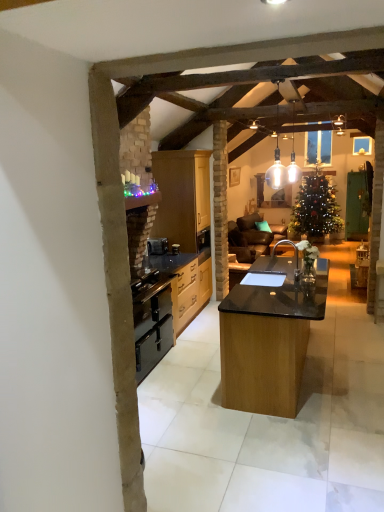
Question: Does translucent glass pendant lights at upper center touch black matte sink at center?

Choices:
 (A) no
 (B) yes

Answer: (A)

Question: From a real-world perspective, is translucent glass pendant lights at upper center located higher than black matte sink at center?

Choices:
 (A) yes
 (B) no

Answer: (A)

Question: Is translucent glass pendant lights at upper center facing away from black matte sink at center?

Choices:
 (A) yes
 (B) no

Answer: (B)

Question: Is translucent glass pendant lights at upper center smaller than black matte sink at center?

Choices:
 (A) no
 (B) yes

Answer: (B)

Question: Could you tell me if translucent glass pendant lights at upper center is facing black matte sink at center?

Choices:
 (A) yes
 (B) no

Answer: (B)

Question: Is translucent glass pendant lights at upper center completely or partially outside of black matte sink at center?

Choices:
 (A) yes
 (B) no

Answer: (A)

Question: Does black wood cabinets at center, arranged as the first cabinetry when ordered from the bottom, come in front of translucent glass pendant lights at upper center?

Choices:
 (A) yes
 (B) no

Answer: (B)

Question: Would you consider black wood cabinets at center, the 2th cabinetry in the top-to-bottom sequence, to be distant from translucent glass pendant lights at upper center?

Choices:
 (A) no
 (B) yes

Answer: (B)

Question: Considering the relative sizes of black wood cabinets at center, the 2th cabinetry in the top-to-bottom sequence, and translucent glass pendant lights at upper center in the image provided, is black wood cabinets at center, the 2th cabinetry in the top-to-bottom sequence, bigger than translucent glass pendant lights at upper center?

Choices:
 (A) no
 (B) yes

Answer: (B)

Question: From the image's perspective, would you say black wood cabinets at center, the 2th cabinetry in the top-to-bottom sequence, is shown under translucent glass pendant lights at upper center?

Choices:
 (A) no
 (B) yes

Answer: (B)

Question: From a real-world perspective, is black wood cabinets at center, arranged as the first cabinetry when ordered from the bottom, located beneath translucent glass pendant lights at upper center?

Choices:
 (A) yes
 (B) no

Answer: (A)

Question: Is black wood cabinets at center, the 2th cabinetry in the top-to-bottom sequence, positioned behind translucent glass pendant lights at upper center?

Choices:
 (A) yes
 (B) no

Answer: (A)

Question: Is black matte oven at center thinner than black wood cabinets at center, arranged as the first cabinetry when ordered from the bottom?

Choices:
 (A) yes
 (B) no

Answer: (A)